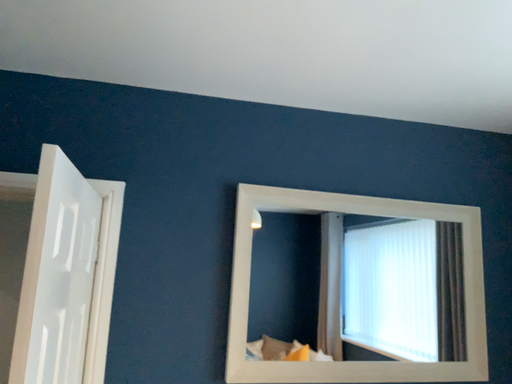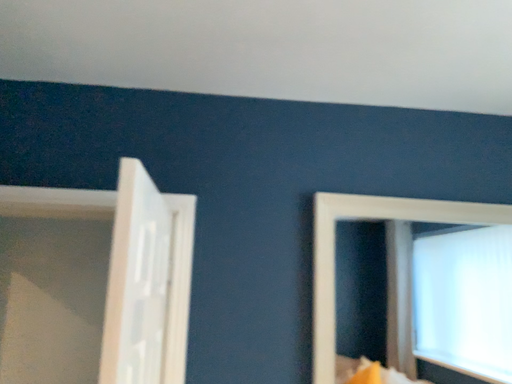
Question: How did the camera likely rotate when shooting the video?

Choices:
 (A) rotated left
 (B) rotated right

Answer: (A)